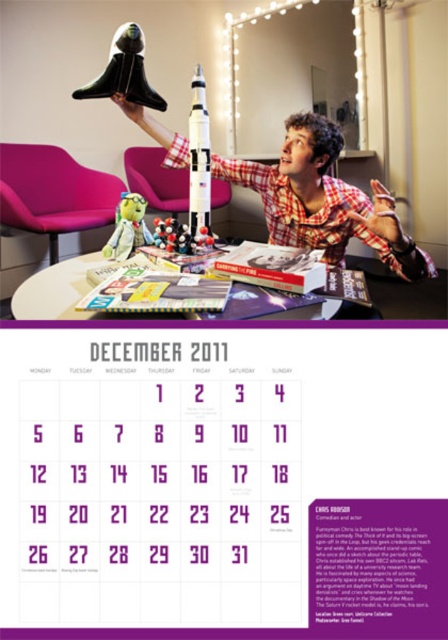
Question: Which point is farther to the camera?

Choices:
 (A) [280, 176]
 (B) [103, 246]

Answer: (B)

Question: Does black matte rocket ship at upper center appear on the left side of green plush toy at center?

Choices:
 (A) yes
 (B) no

Answer: (B)

Question: Which of the following is the farthest from the observer?

Choices:
 (A) black matte rocket ship at upper center
 (B) white glossy table at center
 (C) plaid shirt at upper center
 (D) green plush toy at center

Answer: (D)

Question: Can you confirm if plaid shirt at upper center is positioned above white glossy table at center?

Choices:
 (A) no
 (B) yes

Answer: (B)

Question: Does plaid shirt at upper center lie in front of green plush toy at center?

Choices:
 (A) no
 (B) yes

Answer: (B)

Question: Which point appears closest to the camera in this image?

Choices:
 (A) (115, 234)
 (B) (166, 102)
 (C) (41, 288)

Answer: (C)